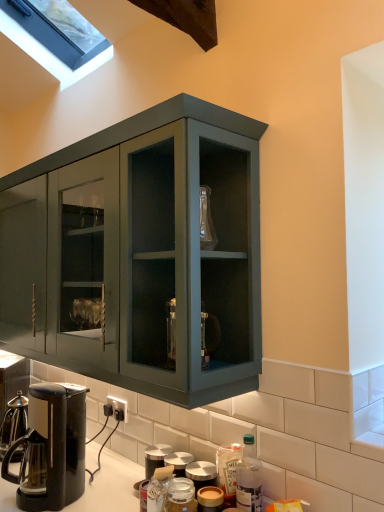
Question: Is translucent plastic bottle at lower center, which is the third bottle in left-to-right order, completely or partially outside of translucent plastic bottle at lower center, the 2th bottle from the left?

Choices:
 (A) yes
 (B) no

Answer: (A)

Question: Is translucent plastic bottle at lower center, which is counted as the first bottle, starting from the right, not close to translucent plastic bottle at lower center, the 2th bottle from the left?

Choices:
 (A) yes
 (B) no

Answer: (B)

Question: Can you confirm if translucent plastic bottle at lower center, which is the third bottle in left-to-right order, is thinner than translucent plastic bottle at lower center, which is the second bottle in right-to-left order?

Choices:
 (A) yes
 (B) no

Answer: (A)

Question: Could you tell me if translucent plastic bottle at lower center, which is counted as the first bottle, starting from the right, is turned towards translucent plastic bottle at lower center, the 2th bottle from the left?

Choices:
 (A) no
 (B) yes

Answer: (A)

Question: Is translucent plastic bottle at lower center, which is the third bottle in left-to-right order, oriented away from translucent plastic bottle at lower center, which is the second bottle in right-to-left order?

Choices:
 (A) yes
 (B) no

Answer: (B)

Question: Does translucent plastic bottle at lower center, which is counted as the first bottle, starting from the right, have a greater width compared to translucent plastic bottle at lower center, the 2th bottle from the left?

Choices:
 (A) yes
 (B) no

Answer: (B)

Question: Is translucent plastic bottle at lower center, which is the second bottle in right-to-left order, to the left of translucent glass jar at lower center, which ranks as the third bottle in right-to-left order, from the viewer's perspective?

Choices:
 (A) no
 (B) yes

Answer: (A)

Question: Would you say translucent plastic bottle at lower center, which is the second bottle in right-to-left order, contains translucent glass jar at lower center, which ranks as the third bottle in right-to-left order?

Choices:
 (A) no
 (B) yes

Answer: (A)

Question: Is translucent plastic bottle at lower center, which is the second bottle in right-to-left order, thinner than translucent glass jar at lower center, which ranks as the third bottle in right-to-left order?

Choices:
 (A) no
 (B) yes

Answer: (B)

Question: Is translucent plastic bottle at lower center, the 2th bottle from the left, shorter than translucent glass jar at lower center, which ranks as the third bottle in right-to-left order?

Choices:
 (A) no
 (B) yes

Answer: (A)

Question: Is translucent plastic bottle at lower center, which is the second bottle in right-to-left order, further to the viewer compared to translucent glass jar at lower center, which ranks as the 1th bottle in left-to-right order?

Choices:
 (A) no
 (B) yes

Answer: (B)

Question: From the image's perspective, is translucent plastic bottle at lower center, the 2th bottle from the left, over translucent glass jar at lower center, which ranks as the third bottle in right-to-left order?

Choices:
 (A) yes
 (B) no

Answer: (A)

Question: Is translucent plastic bottle at lower center, which is the second bottle in right-to-left order, surrounding clear glass window at upper left?

Choices:
 (A) yes
 (B) no

Answer: (B)